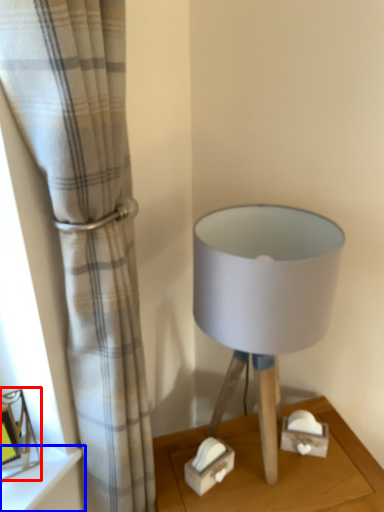
Question: Which object appears farthest to the camera in this image, picture frame (highlighted by a red box) or shelf (highlighted by a blue box)?

Choices:
 (A) picture frame
 (B) shelf

Answer: (B)